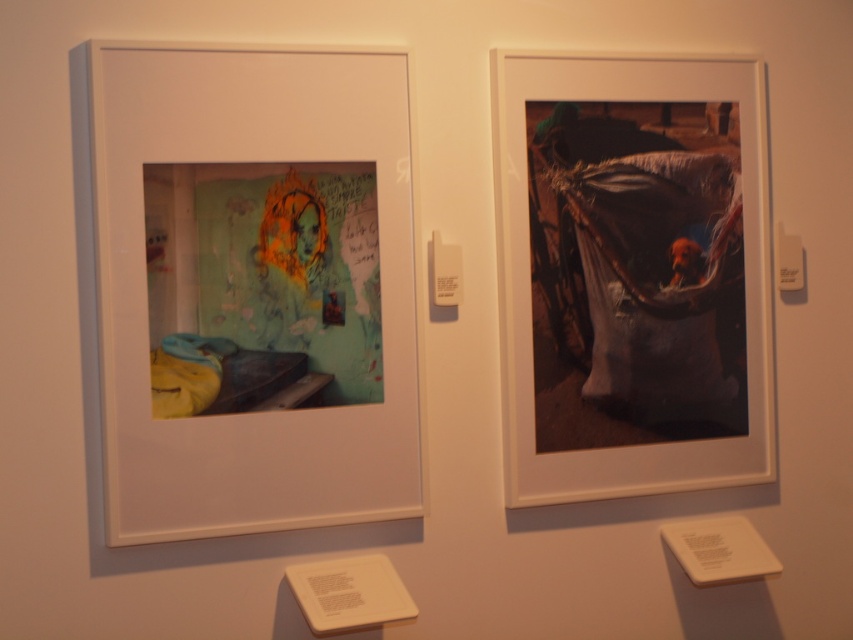
Based on the photo, you are an art critic analyzing the two points of interest in the photographs displayed on the gallery wall. Which of the two points, point (721, 209) or point (409, 317), is closer to your perspective as you stand in front of the artwork?

Point (721, 209) is further to the viewer than point (409, 317). Therefore, point (721, 209) is closer to your perspective as you stand in front of the artwork.